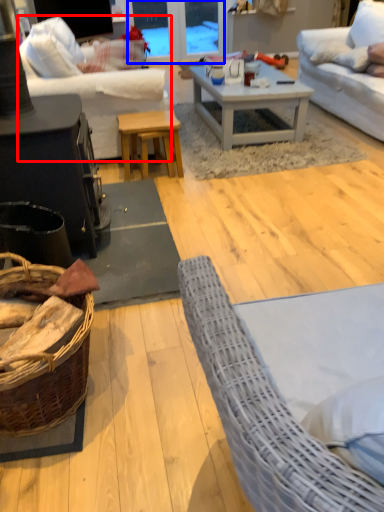
Question: Which point is further to the camera, studio couch (highlighted by a red box) or glass door (highlighted by a blue box)?

Choices:
 (A) studio couch
 (B) glass door

Answer: (B)